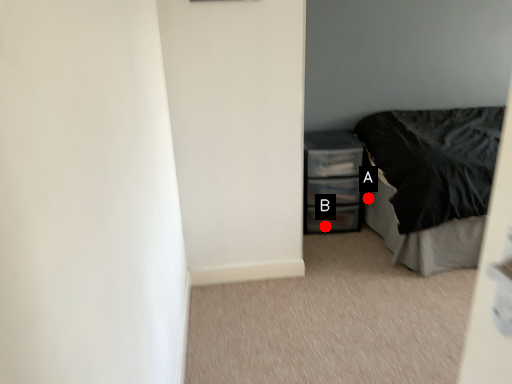
Question: Two points are circled on the image, labeled by A and B beside each circle. Among these points, which one is nearest to the camera?

Choices:
 (A) A is closer
 (B) B is closer

Answer: (B)